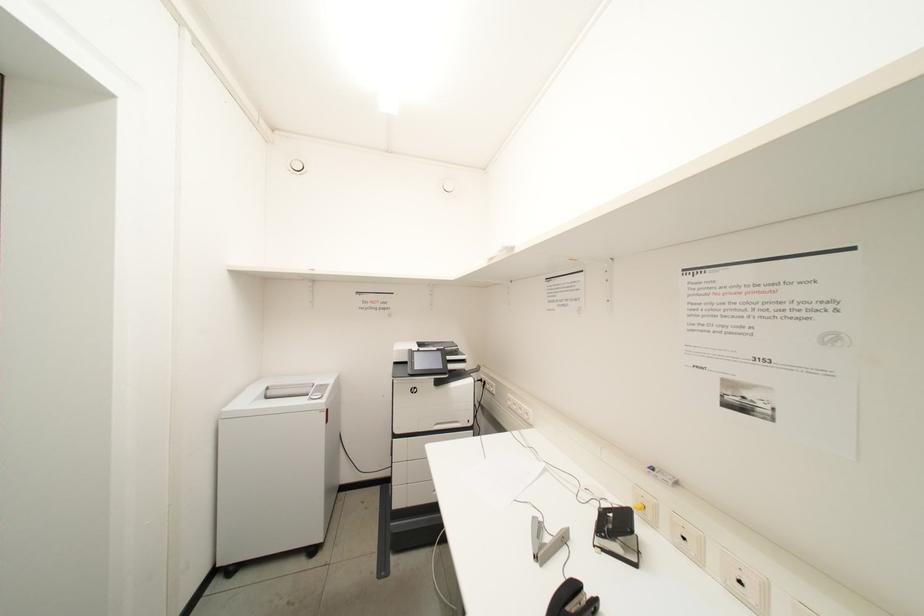
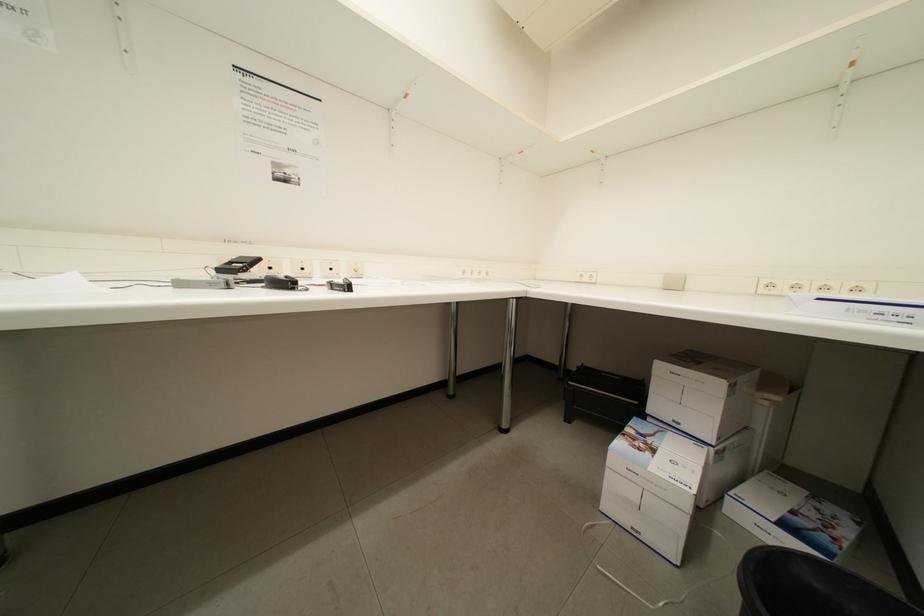
Question: Based on the continuous images, in which direction is the camera rotating? Reply with the corresponding letter.

Choices:
 (A) Left
 (B) Right
 (C) Up
 (D) Down

Answer: (B)